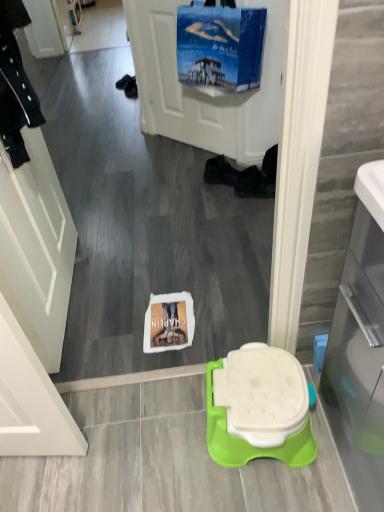
Locate an element on the screen. free space to the back side of white matte screen door at left, which appears as the 2th screen door when viewed from the right is located at coordinates click(x=109, y=228).